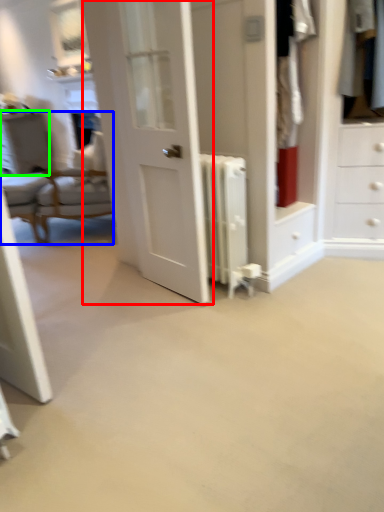
Question: Considering the real-world distances, which object is farthest from door (highlighted by a red box)? chair (highlighted by a blue box) or vanity (highlighted by a green box)?

Choices:
 (A) chair
 (B) vanity

Answer: (B)